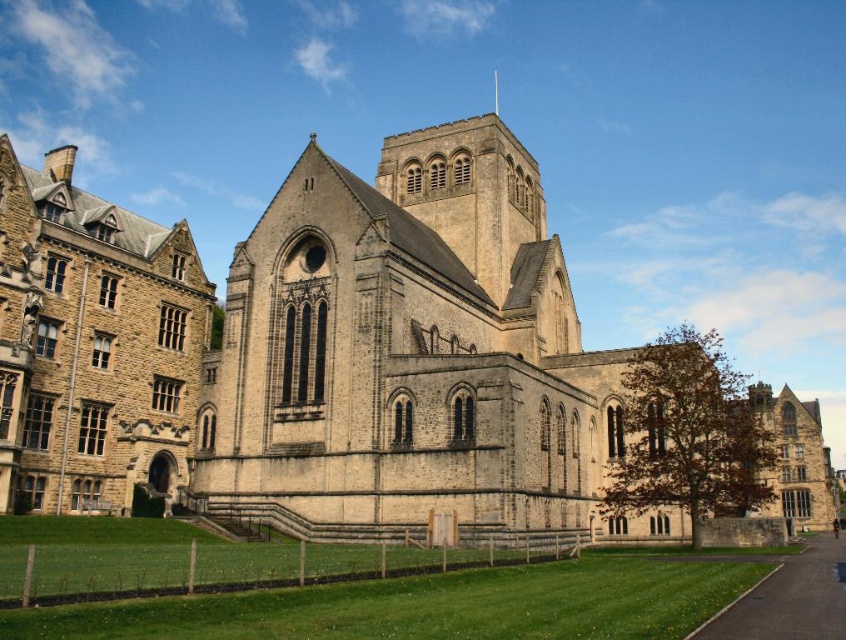
Who is more forward, (520, 225) or (497, 80)?

Point (520, 225)

Does beige stone church at center have a lesser width compared to smooth silver spire at upper center?

No, beige stone church at center is not thinner than smooth silver spire at upper center.

Between point (784, 397) and point (493, 72), which one is positioned behind?

Positioned behind is point (493, 72).

Locate an element on the screen. This screenshot has height=640, width=846. beige stone church at center is located at coordinates (312, 352).

Who is positioned more to the right, stone medieval building at left or smooth silver spire at upper center?

smooth silver spire at upper center is more to the right.

Who is higher up, stone medieval building at left or smooth silver spire at upper center?

smooth silver spire at upper center

Locate an element on the screen. The width and height of the screenshot is (846, 640). stone medieval building at left is located at coordinates (92, 342).

The height and width of the screenshot is (640, 846). Identify the location of stone medieval building at left. (92, 342).

Who is positioned more to the left, beige stone church at center or stone medieval building at left?

stone medieval building at left is more to the left.

What are the coordinates of `beige stone church at center` in the screenshot? It's located at (312, 352).

The height and width of the screenshot is (640, 846). Find the location of `beige stone church at center`. beige stone church at center is located at coordinates (312, 352).